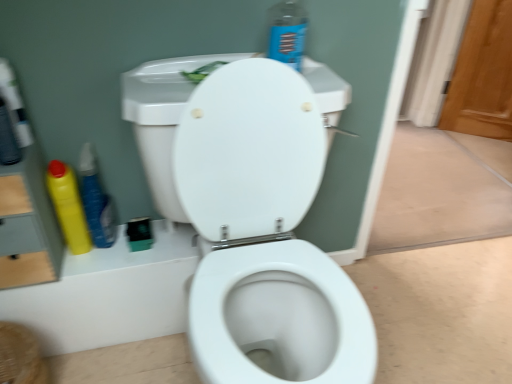
Question: Is blue plastic spray bottle at upper center, placed as the 1th cleaning product when sorted from right to left, looking in the opposite direction of yellow plastic bottle at left, the 1th cleaning product in the left-to-right sequence?

Choices:
 (A) no
 (B) yes

Answer: (A)

Question: Can you confirm if blue plastic spray bottle at upper center, placed as the 1th cleaning product when sorted from right to left, is wider than yellow plastic bottle at left, the 1th cleaning product in the left-to-right sequence?

Choices:
 (A) no
 (B) yes

Answer: (B)

Question: Does blue plastic spray bottle at upper center, arranged as the third cleaning product when viewed from the left, appear on the right side of yellow plastic bottle at left, the 1th cleaning product in the left-to-right sequence?

Choices:
 (A) yes
 (B) no

Answer: (A)

Question: Is blue plastic spray bottle at upper center, placed as the 1th cleaning product when sorted from right to left, to the left of yellow plastic bottle at left, the 1th cleaning product in the left-to-right sequence, from the viewer's perspective?

Choices:
 (A) yes
 (B) no

Answer: (B)

Question: Is the position of blue plastic spray bottle at upper center, placed as the 1th cleaning product when sorted from right to left, less distant than that of yellow plastic bottle at left, the 1th cleaning product in the left-to-right sequence?

Choices:
 (A) no
 (B) yes

Answer: (B)

Question: Is the depth of blue plastic spray bottle at upper center, arranged as the third cleaning product when viewed from the left, greater than that of yellow plastic bottle at left, which appears as the 3th cleaning product when viewed from the right?

Choices:
 (A) yes
 (B) no

Answer: (B)

Question: Is wooden screen door at right positioned with its back to yellow plastic bottle at left, the 1th cleaning product in the left-to-right sequence?

Choices:
 (A) yes
 (B) no

Answer: (B)

Question: Could you tell me if wooden screen door at right is turned towards yellow plastic bottle at left, the 1th cleaning product in the left-to-right sequence?

Choices:
 (A) yes
 (B) no

Answer: (A)

Question: Is wooden screen door at right at the right side of yellow plastic bottle at left, the 1th cleaning product in the left-to-right sequence?

Choices:
 (A) yes
 (B) no

Answer: (A)

Question: From a real-world perspective, is wooden screen door at right under yellow plastic bottle at left, the 1th cleaning product in the left-to-right sequence?

Choices:
 (A) yes
 (B) no

Answer: (A)

Question: Considering the relative positions of wooden screen door at right and yellow plastic bottle at left, which appears as the 3th cleaning product when viewed from the right, in the image provided, is wooden screen door at right to the left of yellow plastic bottle at left, which appears as the 3th cleaning product when viewed from the right, from the viewer's perspective?

Choices:
 (A) no
 (B) yes

Answer: (A)

Question: Is wooden screen door at right next to yellow plastic bottle at left, the 1th cleaning product in the left-to-right sequence, and touching it?

Choices:
 (A) yes
 (B) no

Answer: (B)

Question: Is yellow plastic bottle at left, which ranks as the second cleaning product in left-to-right order, turned away from wooden screen door at right?

Choices:
 (A) yes
 (B) no

Answer: (B)